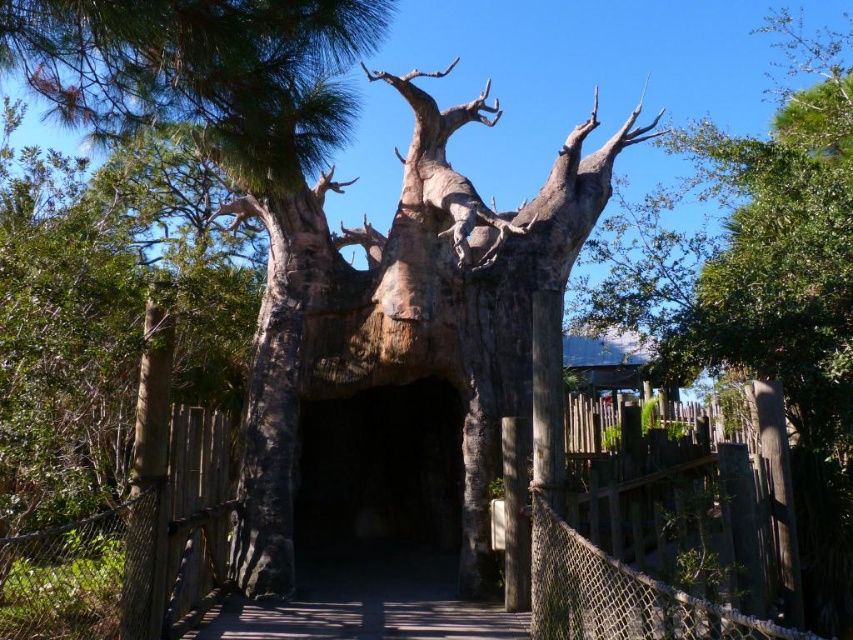
Question: Which of the following is the closest to the observer?

Choices:
 (A) wooden bridge at center
 (B) rope bridge at center

Answer: (B)

Question: Does rope bridge at center have a lesser width compared to dark stone cave at center?

Choices:
 (A) yes
 (B) no

Answer: (A)

Question: Is the position of dark stone cave at center more distant than that of wooden bridge at center?

Choices:
 (A) no
 (B) yes

Answer: (B)

Question: Among these objects, which one is farthest from the camera?

Choices:
 (A) wooden bridge at center
 (B) dark stone cave at center

Answer: (B)

Question: Estimate the real-world distances between objects in this image. Which object is closer to the dark stone cave at center?

Choices:
 (A) rope bridge at center
 (B) wooden bridge at center

Answer: (B)

Question: Considering the relative positions of rope bridge at center and dark stone cave at center in the image provided, where is rope bridge at center located with respect to dark stone cave at center?

Choices:
 (A) left
 (B) right

Answer: (A)